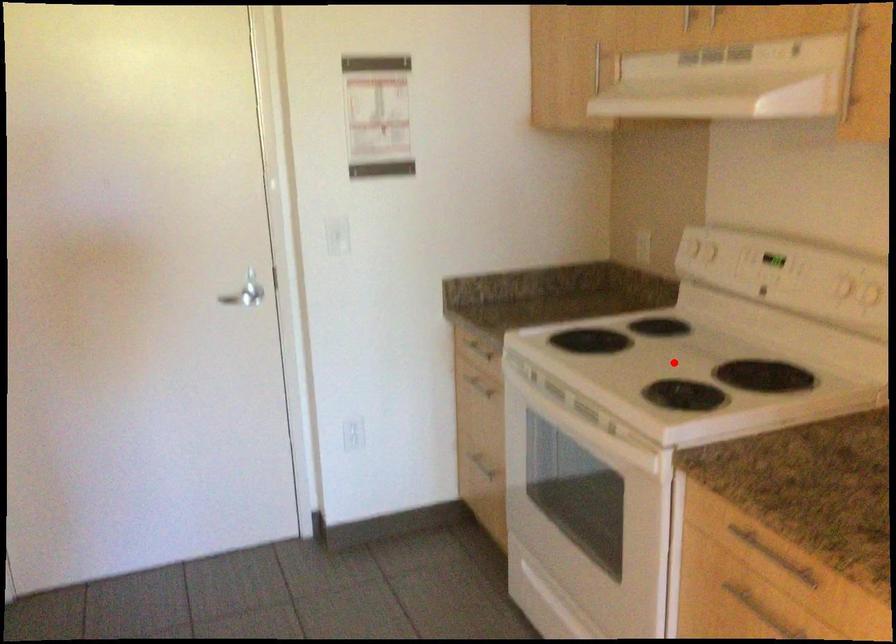
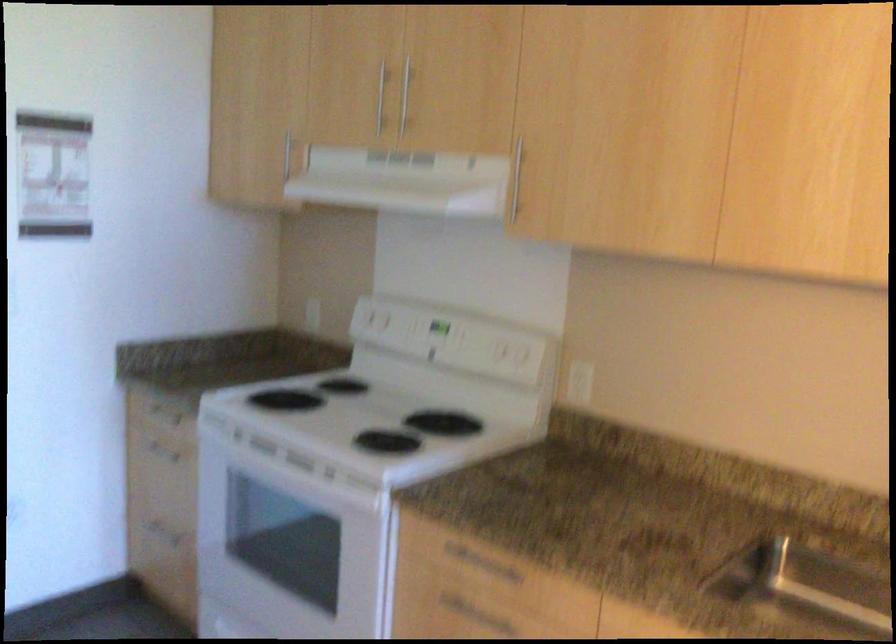
The point at the highlighted location is marked in the first image. Where is the corresponding point in the second image?

(367, 415)